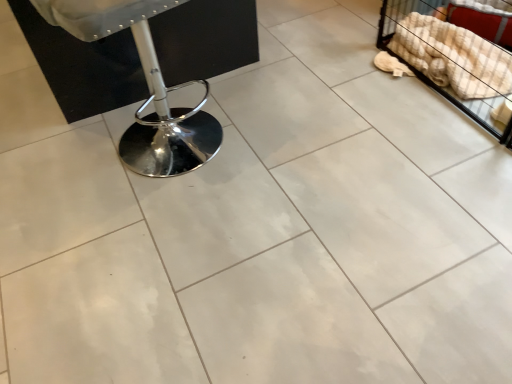
Question: From a real-world perspective, is beige checkered blanket at upper right physically located above or below chrome metallic swivel chair at left?

Choices:
 (A) above
 (B) below

Answer: (B)

Question: In terms of height, does beige checkered blanket at upper right look taller or shorter compared to chrome metallic swivel chair at left?

Choices:
 (A) tall
 (B) short

Answer: (B)

Question: Which is correct: beige checkered blanket at upper right is inside chrome metallic swivel chair at left, or outside of it?

Choices:
 (A) inside
 (B) outside

Answer: (B)

Question: From a real-world perspective, relative to beige checkered blanket at upper right, is chrome metallic swivel chair at left vertically above or below?

Choices:
 (A) above
 (B) below

Answer: (A)

Question: Does point (57, 6) appear closer or farther from the camera than point (388, 8)?

Choices:
 (A) closer
 (B) farther

Answer: (A)

Question: Is chrome metallic swivel chair at left inside the boundaries of beige checkered blanket at upper right, or outside?

Choices:
 (A) outside
 (B) inside

Answer: (A)

Question: Is chrome metallic swivel chair at left to the left or to the right of beige checkered blanket at upper right in the image?

Choices:
 (A) right
 (B) left

Answer: (B)